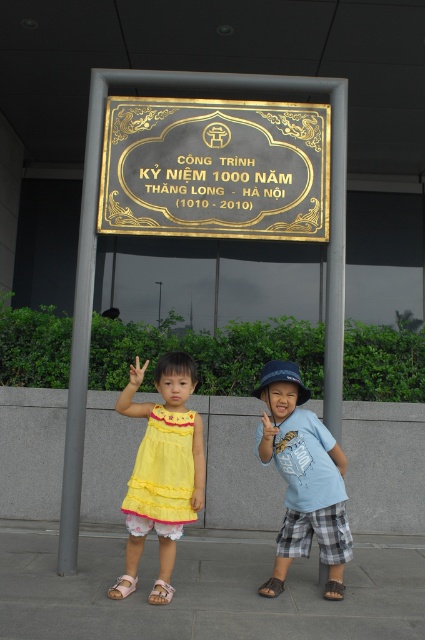
Question: In this image, where is gold/black plaque at center located relative to yellow cotton dress at center?

Choices:
 (A) above
 (B) below

Answer: (A)

Question: Considering the relative positions of gold/black plaque at center and yellow cotton dress at lower center in the image provided, where is gold/black plaque at center located with respect to yellow cotton dress at lower center?

Choices:
 (A) left
 (B) right

Answer: (A)

Question: Does yellow cotton dress at center lie in front of blue cotton shirt at center?

Choices:
 (A) no
 (B) yes

Answer: (B)

Question: Which point is closer to the camera?

Choices:
 (A) gold/black plaque at center
 (B) blue cotton shirt at center
 (C) yellow cotton dress at center

Answer: (C)

Question: Based on their relative distances, which object is nearer to the yellow cotton dress at lower center?

Choices:
 (A) blue cotton shirt at center
 (B) gold/black plaque at center

Answer: (A)

Question: Which object is closer to the camera taking this photo?

Choices:
 (A) yellow cotton dress at lower center
 (B) yellow cotton dress at center
 (C) blue cotton shirt at center

Answer: (B)